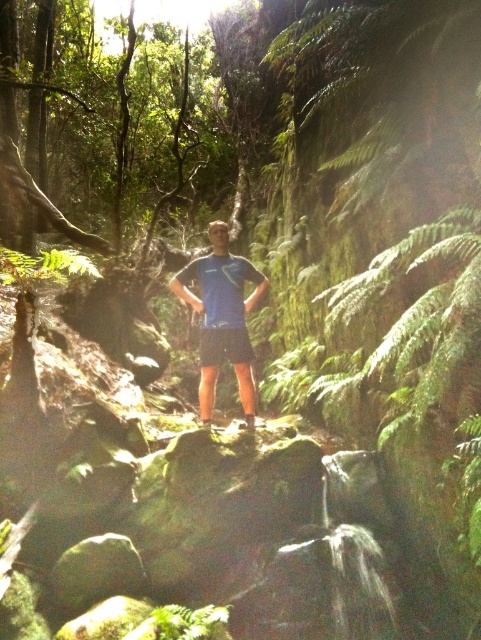
Question: Is the position of blue fabric shirt at center less distant than that of blue fabric shorts at center?

Choices:
 (A) yes
 (B) no

Answer: (A)

Question: Does blue fabric shirt at center appear on the right side of blue fabric shorts at center?

Choices:
 (A) no
 (B) yes

Answer: (A)

Question: Is blue fabric shirt at center smaller than blue fabric shorts at center?

Choices:
 (A) yes
 (B) no

Answer: (B)

Question: Which of the following is the closest to the observer?

Choices:
 (A) (240, 348)
 (B) (244, 336)

Answer: (B)